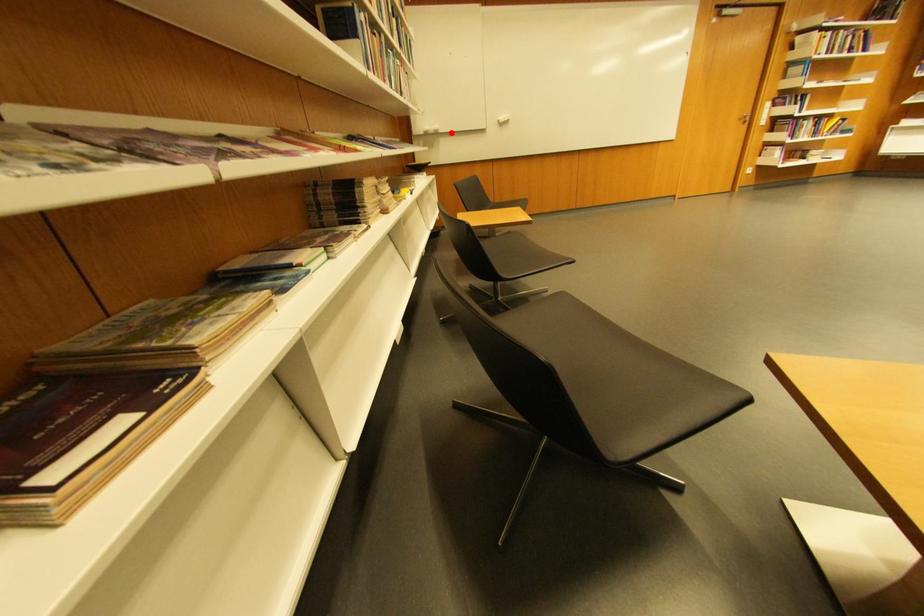
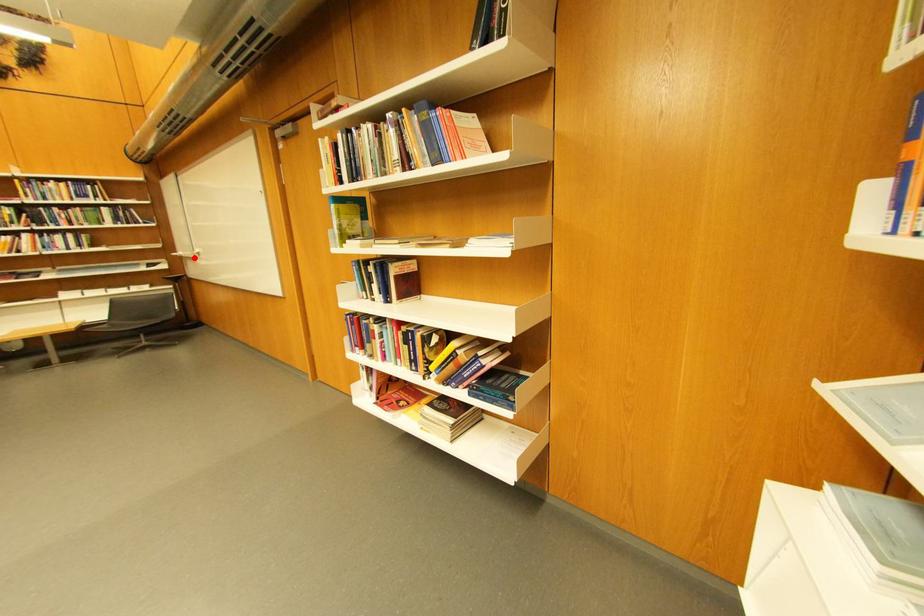
I am providing you with two images of the same scene from different viewpoints. A red point is marked on the first image and another point is marked on the second image. Is the red point in image1 aligned with the point shown in image2?

→ Yes